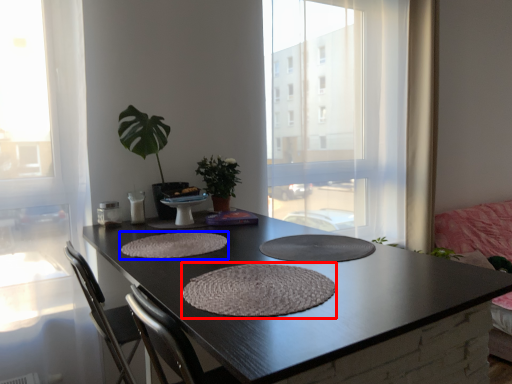
Question: Among these objects, which one is farthest to the camera, wide (highlighted by a red box) or wide (highlighted by a blue box)?

Choices:
 (A) wide
 (B) wide

Answer: (B)